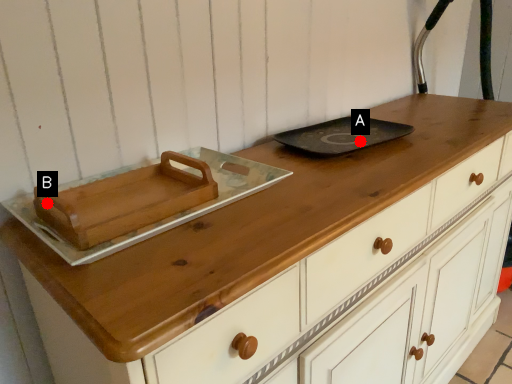
Question: Two points are circled on the image, labeled by A and B beside each circle. Which of the following is the closest to the observer?

Choices:
 (A) A is closer
 (B) B is closer

Answer: (B)